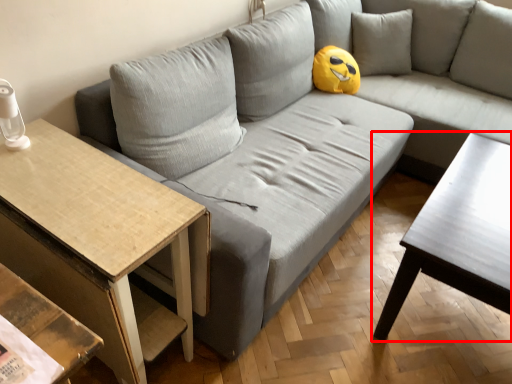
Question: From the image's perspective, where is coffee table (annotated by the red box) located relative to table?

Choices:
 (A) below
 (B) above

Answer: (B)